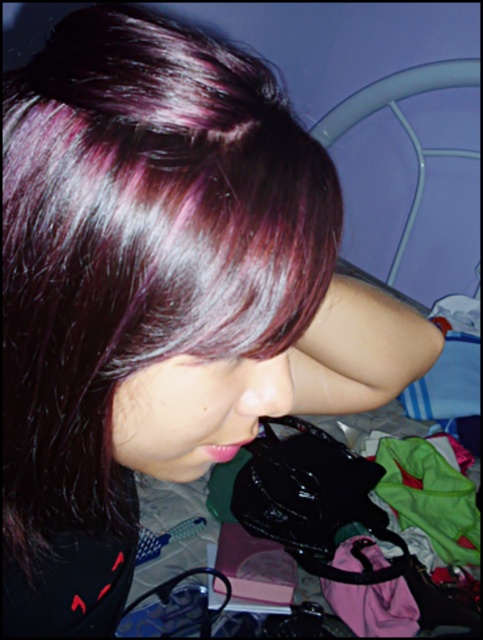
You are organizing a closet and need to know the arrangement of fabrics in the image. Are the green fabric at lower right placed above or below the purple fabric at lower right?

The green fabric at lower right is located above the purple fabric at lower right.

You are organizing a small event and need to know which fabric to use for a backdrop. You see the green fabric at lower right and the purple fabric at lower right in the image. Based on their widths, which one would you choose if you want a wider fabric for the backdrop?

The green fabric at lower right might be wider than purple fabric at lower right, so you should choose the green fabric at lower right for the backdrop.

You are organizing a closet and need to know which fabric is taller between the green fabric at lower right and the purple fabric at lower right. Which one should you choose?

The green fabric at lower right has a greater height compared to the purple fabric at lower right, so you should choose the green fabric at lower right.